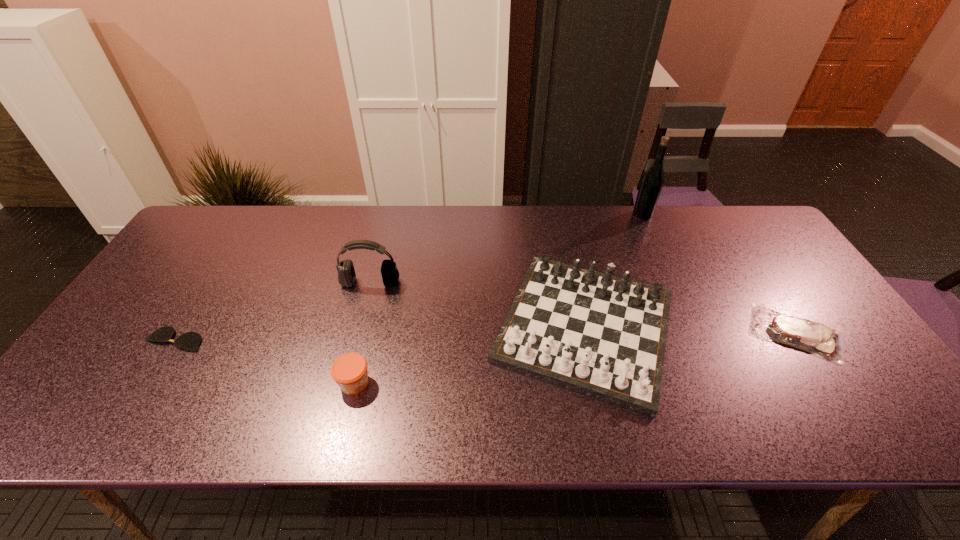
In order to click on free area in between the fourth shortest object and the fifth tallest object in this screenshot , I will do `click(690, 330)`.

Where is `free space between the chessboard and the headset`? free space between the chessboard and the headset is located at coordinates (478, 305).

Identify the location of free space that is in between the fourth shortest object and the fourth tallest object. (469, 355).

Where is `the fourth closest object to the second tallest object`? The width and height of the screenshot is (960, 540). the fourth closest object to the second tallest object is located at coordinates (652, 182).

Find the location of a particular element. Image resolution: width=960 pixels, height=540 pixels. object that is the fourth closest to the beer bottle is located at coordinates (350, 372).

Locate an element on the screen. free space in the image that satisfies the following two spatial constraints: 1. on the headband of the third tallest object; 2. on the right side of the headset is located at coordinates (359, 327).

The width and height of the screenshot is (960, 540). What are the coordinates of `vacant region that satisfies the following two spatial constraints: 1. on the headband of the chessboard; 2. on the left side of the fifth shortest object` in the screenshot? It's located at (359, 327).

In order to click on vacant point that satisfies the following two spatial constraints: 1. on the back side of the rightmost object; 2. on the left side of the leftmost object in this screenshot , I will do `click(180, 333)`.

I want to click on blank space that satisfies the following two spatial constraints: 1. on the headband of the fifth shortest object; 2. on the right side of the chessboard, so click(359, 327).